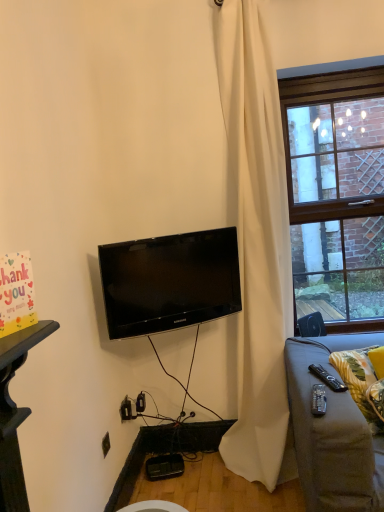
Question: Is white matte curtain at center taller than black plastic remote control at lower right, acting as the 1th remote control starting from the left?

Choices:
 (A) yes
 (B) no

Answer: (A)

Question: Is white matte curtain at center wider than black plastic remote control at lower right, marked as the 2th remote control in a back-to-front arrangement?

Choices:
 (A) no
 (B) yes

Answer: (B)

Question: Is black plastic remote control at lower right, the first remote control in the front-to-back sequence, at the back of white matte curtain at center?

Choices:
 (A) yes
 (B) no

Answer: (B)

Question: Is white matte curtain at center thinner than black plastic remote control at lower right, marked as the 2th remote control in a back-to-front arrangement?

Choices:
 (A) no
 (B) yes

Answer: (A)

Question: Is white matte curtain at center facing towards black plastic remote control at lower right, which is the 2th remote control from right to left?

Choices:
 (A) no
 (B) yes

Answer: (B)

Question: Considering the relative positions of yellow fabric pillow at lower right and black glossy tv at center in the image provided, is yellow fabric pillow at lower right to the left or to the right of black glossy tv at center?

Choices:
 (A) left
 (B) right

Answer: (B)

Question: From a real-world perspective, relative to black glossy tv at center, is yellow fabric pillow at lower right vertically above or below?

Choices:
 (A) below
 (B) above

Answer: (A)

Question: In terms of width, does yellow fabric pillow at lower right look wider or thinner when compared to black glossy tv at center?

Choices:
 (A) thin
 (B) wide

Answer: (B)

Question: Considering the positions of point (357, 358) and point (223, 236), is point (357, 358) closer or farther from the camera than point (223, 236)?

Choices:
 (A) closer
 (B) farther

Answer: (A)

Question: In terms of height, does yellow fabric pillow at lower right look taller or shorter compared to black plastic remote control at lower right, placed as the second remote control when sorted from front to back?

Choices:
 (A) short
 (B) tall

Answer: (B)

Question: Considering the positions of yellow fabric pillow at lower right and black plastic remote control at lower right, which appears as the first remote control when viewed from the right, in the image, is yellow fabric pillow at lower right bigger or smaller than black plastic remote control at lower right, which appears as the first remote control when viewed from the right,?

Choices:
 (A) big
 (B) small

Answer: (A)

Question: From a real-world perspective, is yellow fabric pillow at lower right above or below black plastic remote control at lower right, which appears as the first remote control when viewed from the right?

Choices:
 (A) above
 (B) below

Answer: (B)

Question: From the image's perspective, relative to black plastic remote control at lower right, placed as the second remote control when sorted from front to back, is yellow fabric pillow at lower right above or below?

Choices:
 (A) below
 (B) above

Answer: (A)

Question: Looking at the image, does brick wall at right seem bigger or smaller compared to black glossy tv at center?

Choices:
 (A) small
 (B) big

Answer: (B)

Question: In the image, is brick wall at right on the left side or the right side of black glossy tv at center?

Choices:
 (A) left
 (B) right

Answer: (B)